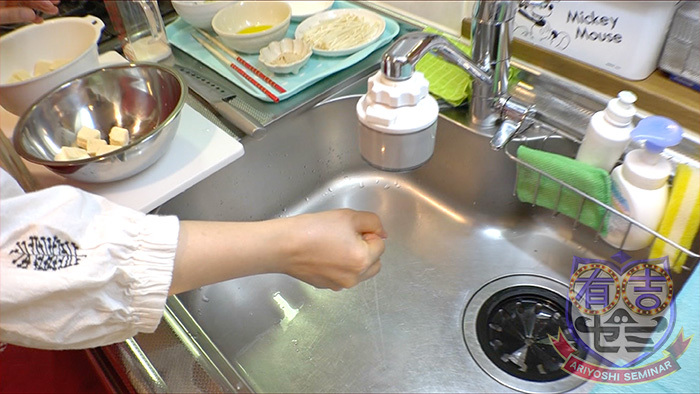
Identify the location of bottle. Image resolution: width=700 pixels, height=394 pixels. (145, 31).